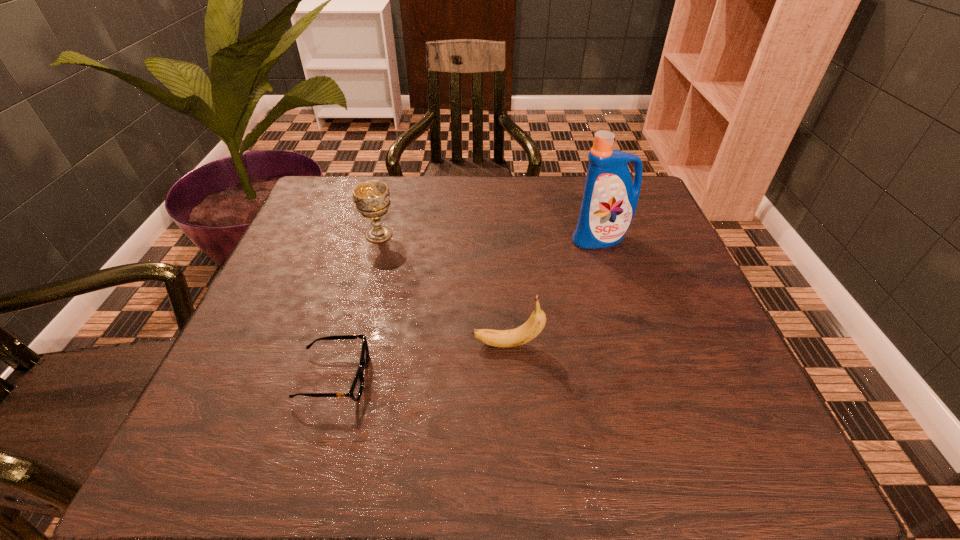
You are a GUI agent. You are given a task and a screenshot of the screen. Output one action in this format:
    pyautogui.click(x=<x>, y=<y>)
    Task: Click on the free space between the chalice and the banana
    
    Given the screenshot: What is the action you would take?
    pyautogui.click(x=444, y=289)

The width and height of the screenshot is (960, 540). In order to click on vacant space in between the second object from right to left and the tallest object in this screenshot , I will do `click(554, 292)`.

Locate an element on the screen. Image resolution: width=960 pixels, height=540 pixels. empty location between the tallest object and the third object from left to right is located at coordinates tap(554, 292).

At what (x,y) coordinates should I click in order to perform the action: click on empty space that is in between the sunglasses and the chalice. Please return your answer as a coordinate pair (x, y). The height and width of the screenshot is (540, 960). Looking at the image, I should click on (357, 306).

I want to click on vacant point located between the chalice and the third object from left to right, so click(x=444, y=289).

Locate an element on the screen. The image size is (960, 540). free area in between the shortest object and the detergent is located at coordinates (468, 308).

In order to click on free space between the chalice and the banana in this screenshot , I will do `click(444, 289)`.

This screenshot has width=960, height=540. I want to click on vacant region between the tallest object and the chalice, so [490, 237].

The height and width of the screenshot is (540, 960). I want to click on object that stands as the second closest to the chalice, so pyautogui.click(x=534, y=325).

Locate which object is the third closest to the second object from right to left. Please provide its 2D coordinates. Your answer should be formatted as a tuple, i.e. [(x, y)], where the tuple contains the x and y coordinates of a point satisfying the conditions above.

[(371, 198)]